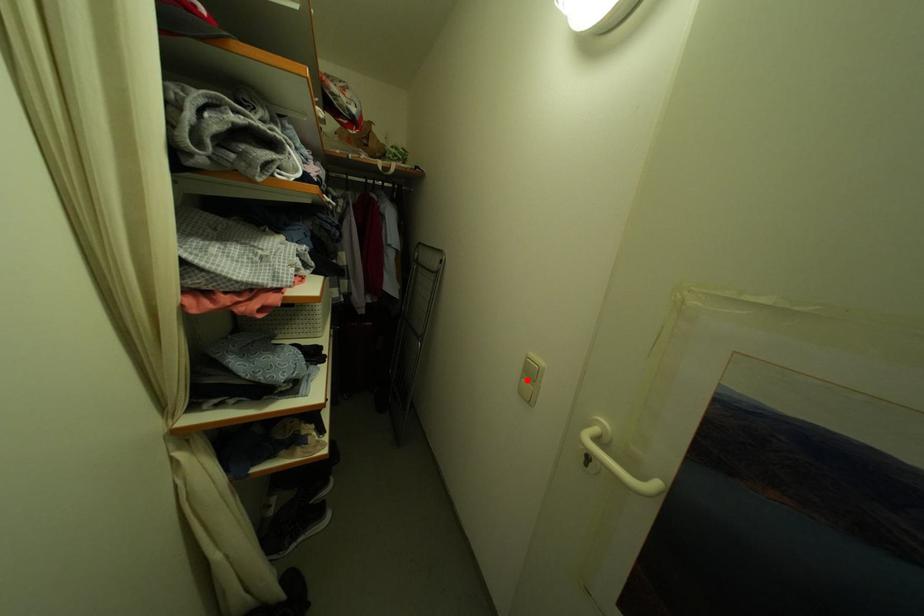
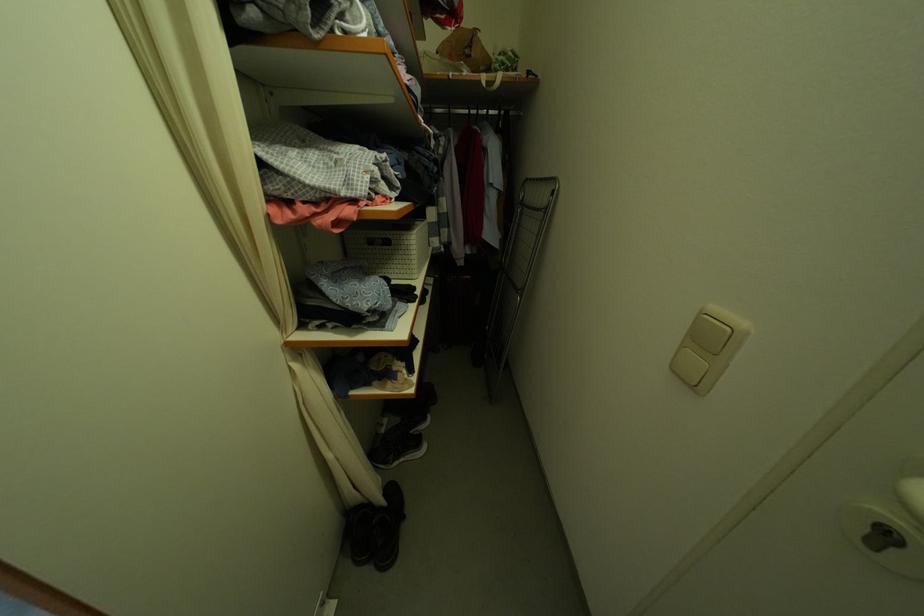
Where in the second image is the point corresponding to the highlighted location from the first image?

(688, 349)